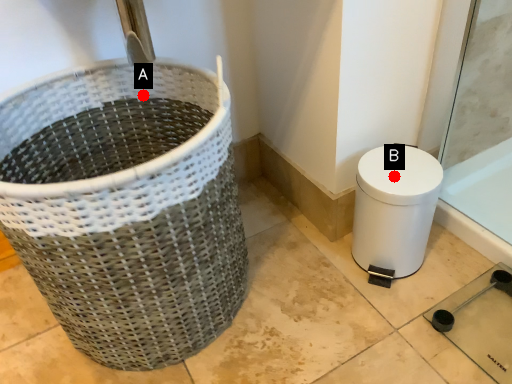
Question: Two points are circled on the image, labeled by A and B beside each circle. Which point is farther to the camera?

Choices:
 (A) A is further
 (B) B is further

Answer: (A)